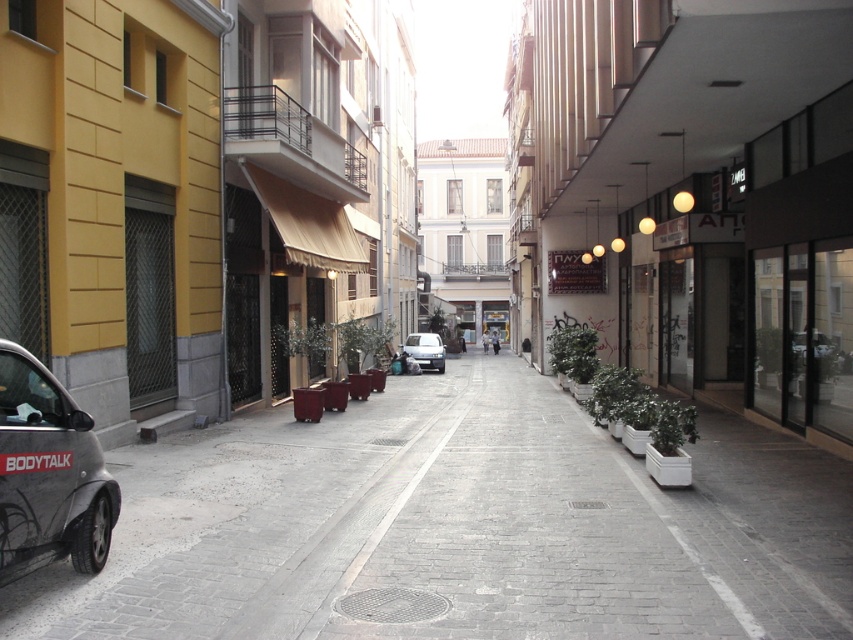
You are a delivery person trying to park your bike between the gray concrete pavement at center and the matte black car at left. Can you fit your bike there?

The gray concrete pavement at center is located below the matte black car at left, meaning there is no space between them for the bike to fit.

You are a delivery person trying to park your white matte van at center in this narrow street. There is a gray concrete pavement at center where you want to park. Can you park your van there without blocking the pavement?

The gray concrete pavement at center is positioned under the white matte van at center, so parking the van there would block the pavement.

You are a delivery person who needs to park a new vehicle between the matte black car at left and the white matte van at center. The new vehicle is 1.8 meters wide. Can you fit it in the space between them?

The matte black car at left is narrower than the white matte van at center, but the exact width of the space between them isn not provided. However, since the new vehicle is 1.8 meters wide, you should measure the available space to ensure it accommodates the vehicle.